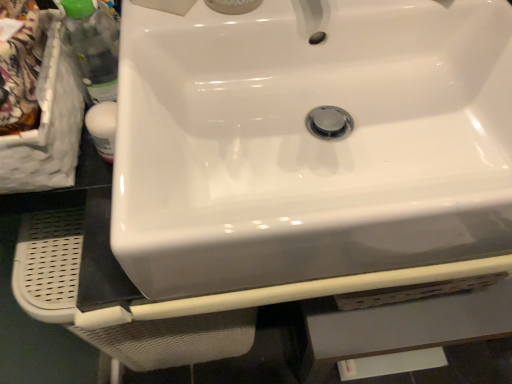
Question: Is translucent plastic bottle at left located within white glossy sink at center?

Choices:
 (A) no
 (B) yes

Answer: (A)

Question: Can you confirm if white glossy sink at center is bigger than translucent plastic bottle at left?

Choices:
 (A) yes
 (B) no

Answer: (A)

Question: Is white glossy sink at center taller than translucent plastic bottle at left?

Choices:
 (A) no
 (B) yes

Answer: (A)

Question: Does white glossy sink at center appear on the left side of translucent plastic bottle at left?

Choices:
 (A) no
 (B) yes

Answer: (A)

Question: Are white glossy sink at center and translucent plastic bottle at left far apart?

Choices:
 (A) yes
 (B) no

Answer: (B)

Question: Does white glossy sink at center appear on the right side of translucent plastic bottle at left?

Choices:
 (A) no
 (B) yes

Answer: (B)

Question: Considering the relative sizes of translucent plastic bottle at left and white glossy sink at center in the image provided, is translucent plastic bottle at left wider than white glossy sink at center?

Choices:
 (A) no
 (B) yes

Answer: (A)

Question: Can you confirm if translucent plastic bottle at left is taller than white glossy sink at center?

Choices:
 (A) yes
 (B) no

Answer: (A)

Question: Can you confirm if translucent plastic bottle at left is smaller than white glossy sink at center?

Choices:
 (A) yes
 (B) no

Answer: (A)

Question: Is white glossy sink at center a part of translucent plastic bottle at left?

Choices:
 (A) no
 (B) yes

Answer: (A)

Question: Is translucent plastic bottle at left at the right side of white glossy sink at center?

Choices:
 (A) yes
 (B) no

Answer: (B)

Question: From the image's perspective, does translucent plastic bottle at left appear lower than white glossy sink at center?

Choices:
 (A) no
 (B) yes

Answer: (A)

Question: From the image's perspective, is translucent plastic bottle at left located above or below white glossy sink at center?

Choices:
 (A) below
 (B) above

Answer: (B)